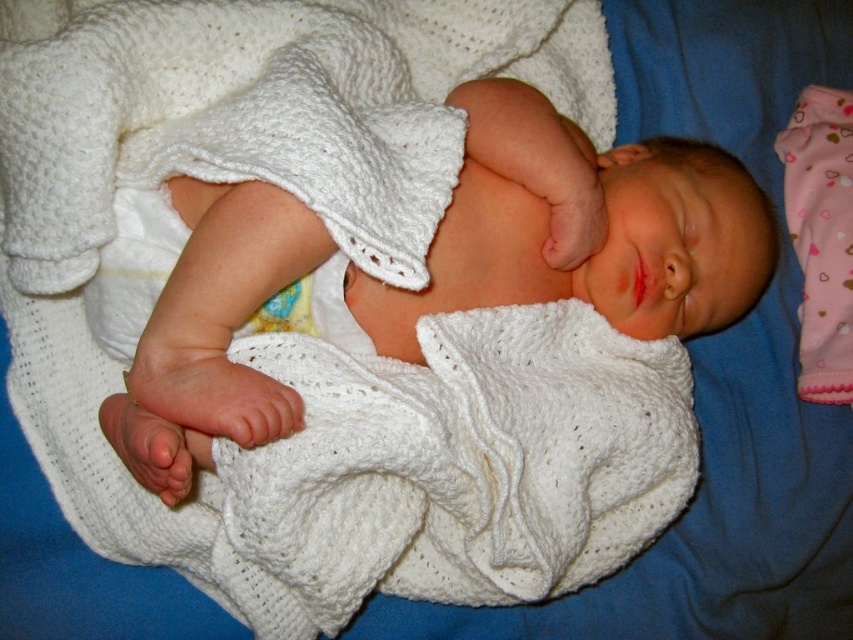
You are a photographer taking a picture of the newborn baby. The camera is focused on the point at coordinates [425,262]. Which object is exactly at this point?

The white knitted blanket at center is located at point [425,262].

You are a photographer taking a picture of the newborn baby. You notice two points in the image at coordinates point [612,280] and point [639,253]. Which point is closer to the camera?

Point [612,280] is further to the camera than point [639,253], so the closer point to the camera is point [639,253].